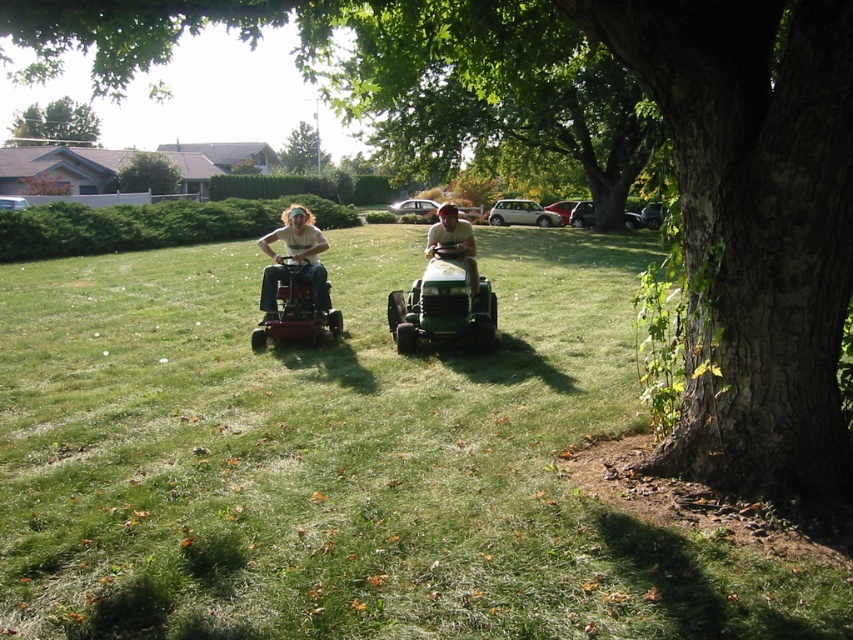
You are standing at the point marked as point [56,122]. What object is located exactly at this point?

The green leafy tree at upper left is located exactly at point [56,122].